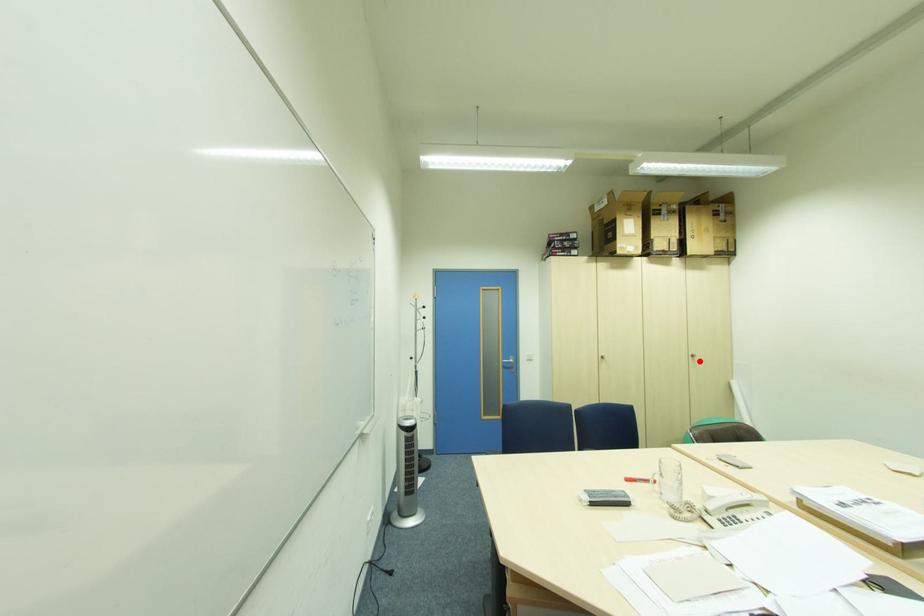
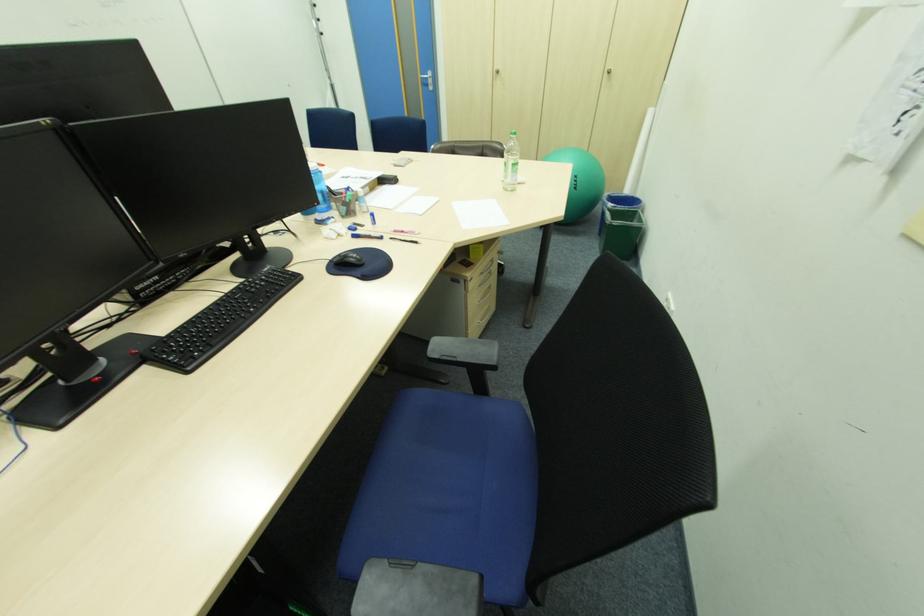
Find the pixel in the second image that matches the highlighted location in the first image.

(615, 79)